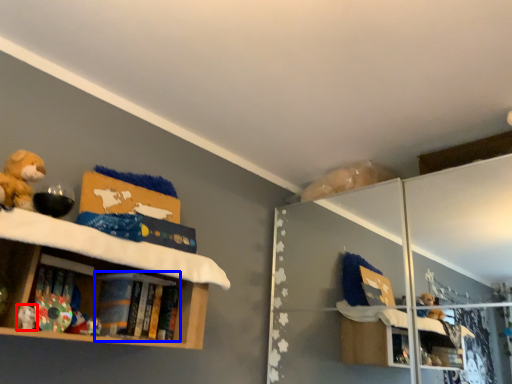
Question: Among these objects, which one is nearest to the camera, toy (highlighted by a red box) or book (highlighted by a blue box)?

Choices:
 (A) toy
 (B) book

Answer: (A)